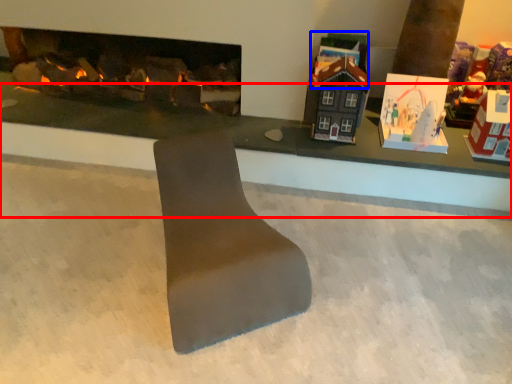
Question: Among these objects, which one is farthest to the camera, table (highlighted by a red box) or toy (highlighted by a blue box)?

Choices:
 (A) table
 (B) toy

Answer: (B)